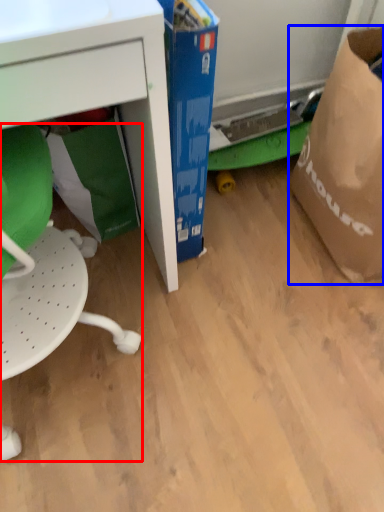
Question: Which point is closer to the camera, swivel chair (highlighted by a red box) or grocery bag (highlighted by a blue box)?

Choices:
 (A) swivel chair
 (B) grocery bag

Answer: (A)